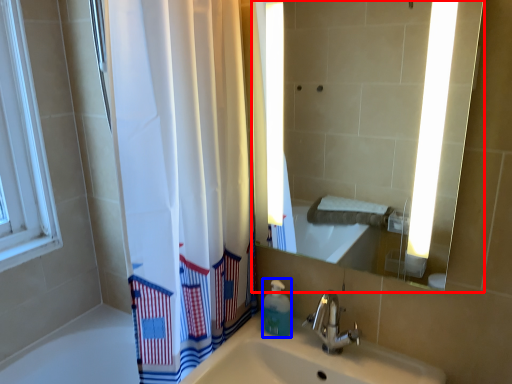
Question: Which point is closer to the camera, mirror (highlighted by a red box) or soap dispenser (highlighted by a blue box)?

Choices:
 (A) mirror
 (B) soap dispenser

Answer: (A)